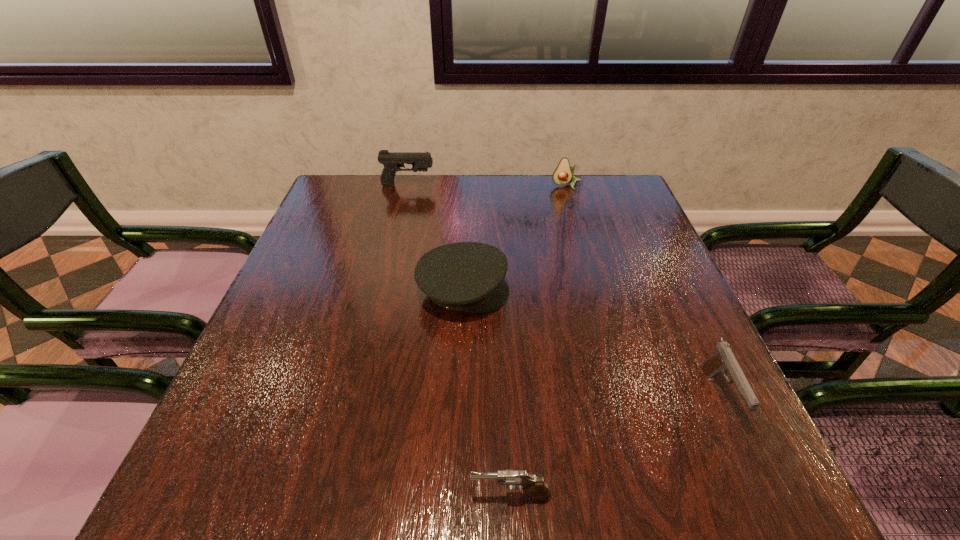
Where is `pistol that is at the right edge`? The height and width of the screenshot is (540, 960). pistol that is at the right edge is located at coordinates (723, 360).

At what (x,y) coordinates should I click in order to perform the action: click on object located at the far left corner. Please return your answer as a coordinate pair (x, y). Looking at the image, I should click on point(392,161).

Where is `object located at the far right corner`? The height and width of the screenshot is (540, 960). object located at the far right corner is located at coordinates (563, 174).

The image size is (960, 540). Identify the location of blank area at the far edge. (581, 218).

The height and width of the screenshot is (540, 960). In the image, there is a desktop. Identify the location of vacant area at the near edge. (305, 473).

At what (x,y) coordinates should I click in order to perform the action: click on blank area at the left edge. Please return your answer as a coordinate pair (x, y). Image resolution: width=960 pixels, height=540 pixels. Looking at the image, I should click on (251, 423).

This screenshot has width=960, height=540. In the image, there is a desktop. Identify the location of free space at the right edge. (604, 255).

Where is `blank area at the far left corner`? blank area at the far left corner is located at coordinates (335, 178).

At what (x,y) coordinates should I click in order to perform the action: click on free space at the near left corner. Please return your answer as a coordinate pair (x, y). Image resolution: width=960 pixels, height=540 pixels. Looking at the image, I should click on (185, 495).

Image resolution: width=960 pixels, height=540 pixels. Identify the location of vacant space at the far right corner of the desktop. (580, 177).